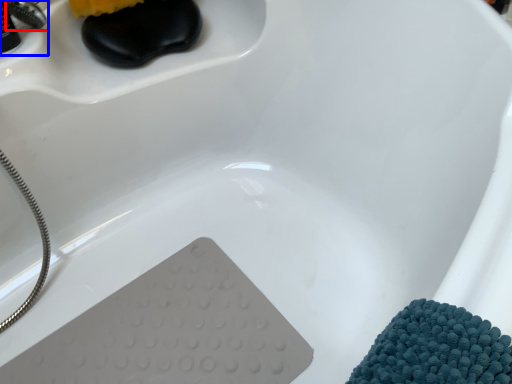
Question: Which of the following is the closest to the observer, faucet (highlighted by a red box) or faucet (highlighted by a blue box)?

Choices:
 (A) faucet
 (B) faucet

Answer: (B)